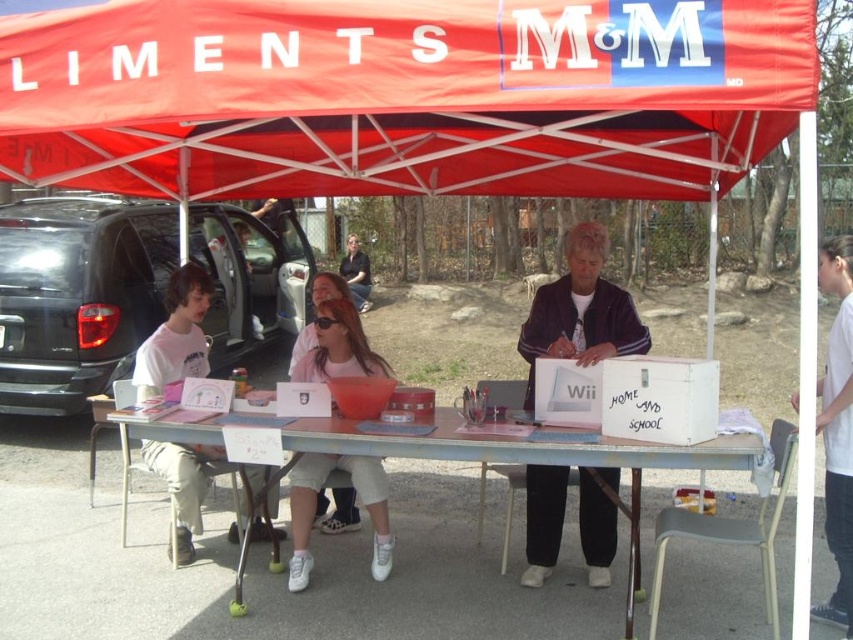
You are standing at point (846, 276) and want to walk to point (332, 465). Is the direction you need to walk forward or backward?

The point (332, 465) is behind point (846, 276). So, to walk from (846, 276) to (332, 465), you need to walk backward.